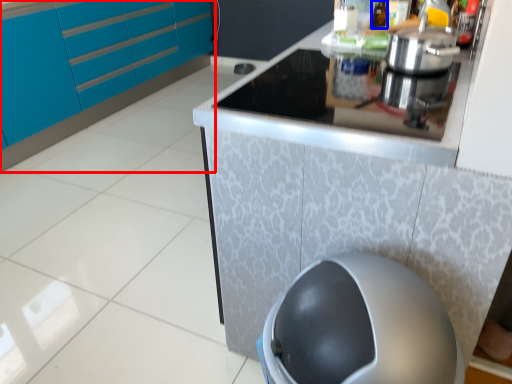
Question: Among these objects, which one is farthest to the camera, cabinetry (highlighted by a red box) or bottle (highlighted by a blue box)?

Choices:
 (A) cabinetry
 (B) bottle

Answer: (A)